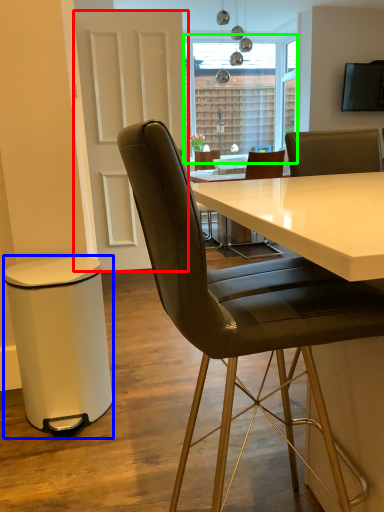
Question: Which is farther away from glass door (highlighted by a red box)? bar stool (highlighted by a blue box) or window screen (highlighted by a green box)?

Choices:
 (A) bar stool
 (B) window screen

Answer: (B)